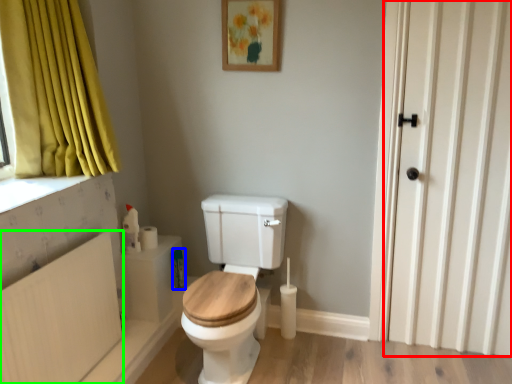
Question: Based on their relative distances, which object is farther from door (highlighted by a red box)? Choose from toiletry (highlighted by a blue box) and radiator (highlighted by a green box).

Choices:
 (A) toiletry
 (B) radiator

Answer: (B)